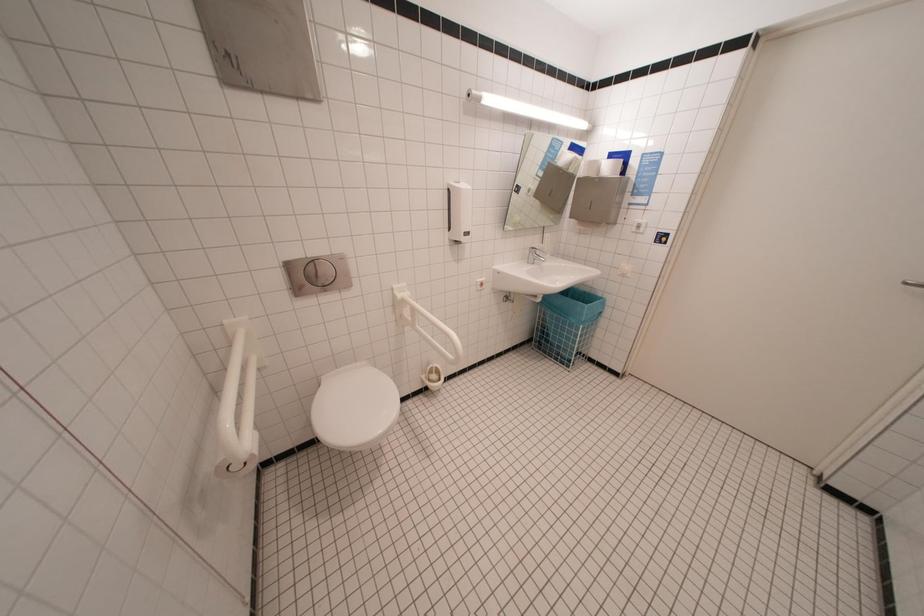
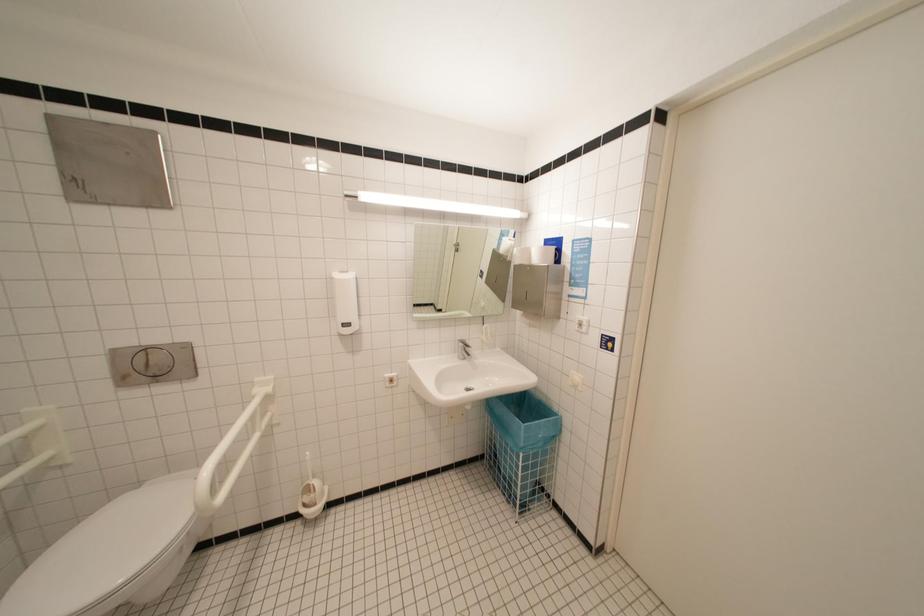
Question: How did the camera likely rotate?

Choices:
 (A) Left
 (B) Right
 (C) Up
 (D) Down

Answer: (C)